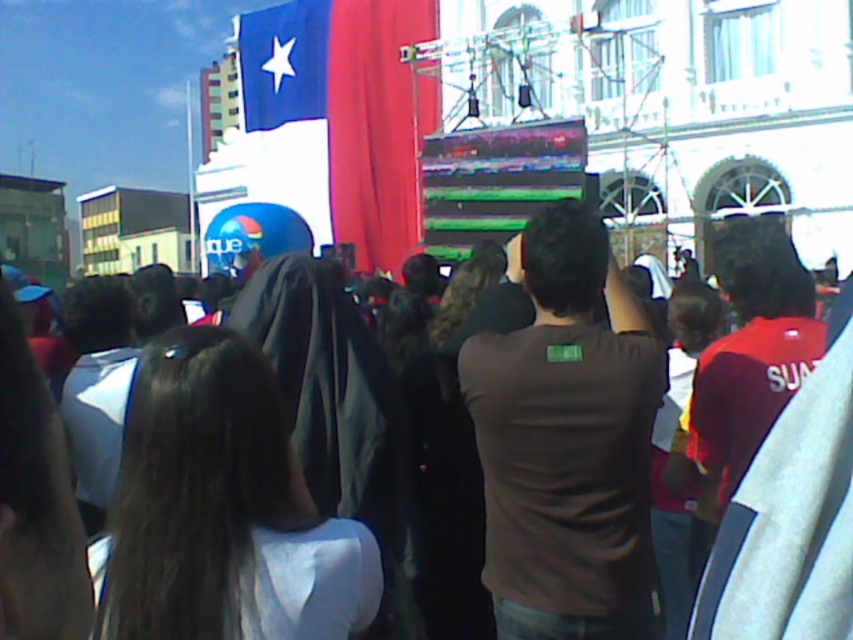
You are a photographer at the event and want to capture a photo of the brown matte shirt at center without the brown fabric crowd at center blocking it. Based on their positions, is this possible?

The brown matte shirt at center is positioned on the left side of brown fabric crowd at center, so if you move to the right side of the crowd, you can capture the shirt without obstruction.

You are at the center of the crowd and want to locate the brown matte shirt at center. According to the coordinates provided, where exactly should you look?

The brown matte shirt at center is located at coordinates point (567, 442).